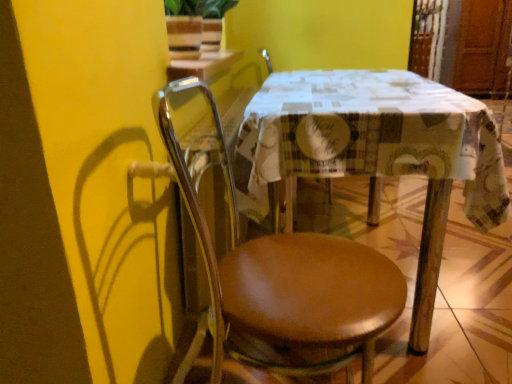
Question: Is printed fabric table at center bigger or smaller than brown leather chair at center?

Choices:
 (A) big
 (B) small

Answer: (A)

Question: Visually, is printed fabric table at center positioned to the left or to the right of brown leather chair at center?

Choices:
 (A) left
 (B) right

Answer: (B)

Question: From their relative heights in the image, would you say printed fabric table at center is taller or shorter than brown leather chair at center?

Choices:
 (A) short
 (B) tall

Answer: (A)

Question: Considering the positions of brown leather chair at center and printed fabric table at center in the image, is brown leather chair at center bigger or smaller than printed fabric table at center?

Choices:
 (A) big
 (B) small

Answer: (B)

Question: Is brown leather chair at center taller or shorter than printed fabric table at center?

Choices:
 (A) short
 (B) tall

Answer: (B)

Question: Looking at their shapes, would you say brown leather chair at center is wider or thinner than printed fabric table at center?

Choices:
 (A) wide
 (B) thin

Answer: (B)

Question: From a real-world perspective, is brown leather chair at center physically located above or below printed fabric table at center?

Choices:
 (A) above
 (B) below

Answer: (A)